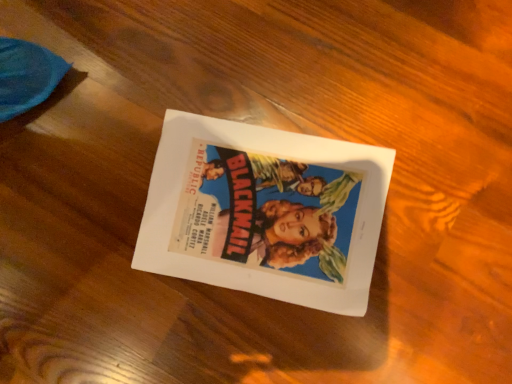
This screenshot has width=512, height=384. Find the location of `empty space that is ontop of white paper at center (from a real-world perspective)`. empty space that is ontop of white paper at center (from a real-world perspective) is located at coordinates (266, 210).